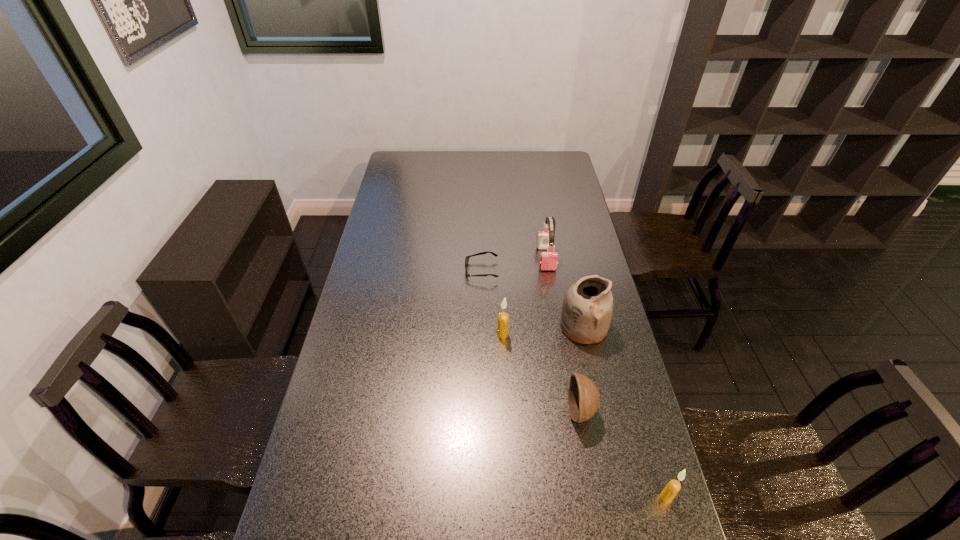
This screenshot has width=960, height=540. What are the coordinates of `bowl at the right edge` in the screenshot? It's located at (583, 396).

Image resolution: width=960 pixels, height=540 pixels. What are the coordinates of `object located in the near right corner section of the desktop` in the screenshot? It's located at (673, 487).

In the image, there is a desktop. Where is `vacant space at the far edge`? vacant space at the far edge is located at coordinates (496, 152).

Find the location of a particular element. blank area at the near edge is located at coordinates (577, 507).

I want to click on vacant space at the left edge of the desktop, so click(x=404, y=203).

In the image, there is a desktop. Find the location of `vacant space at the right edge`. vacant space at the right edge is located at coordinates (558, 235).

Locate an element on the screen. The height and width of the screenshot is (540, 960). free space at the far left corner of the desktop is located at coordinates (396, 166).

Find the location of `vacant area that lies between the shortest object and the earphone`. vacant area that lies between the shortest object and the earphone is located at coordinates (514, 265).

Where is `vacant space that is in between the pottery and the shortest object`? This screenshot has width=960, height=540. vacant space that is in between the pottery and the shortest object is located at coordinates (533, 299).

This screenshot has height=540, width=960. Find the location of `free space between the rightmost object and the earphone`. free space between the rightmost object and the earphone is located at coordinates (606, 377).